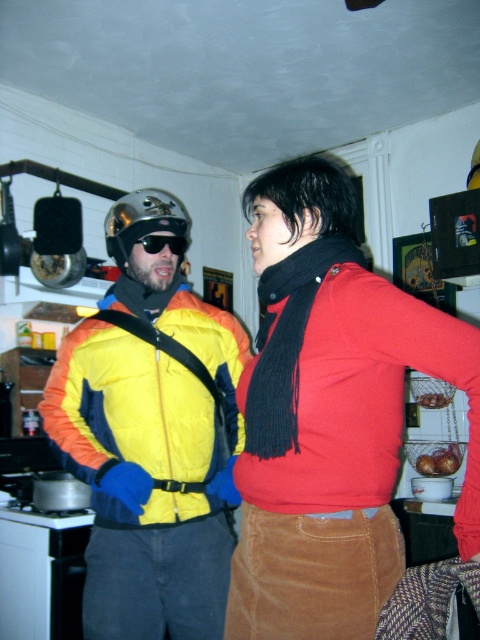
Question: Can you confirm if yellow/padded jacket at center is smaller than black fuzzy scarf at center?

Choices:
 (A) no
 (B) yes

Answer: (A)

Question: Which object is positioned farthest from the red corduroy skirt at center?

Choices:
 (A) black fuzzy scarf at center
 (B) black plastic goggles at upper left

Answer: (B)

Question: Observing the image, what is the correct spatial positioning of red corduroy skirt at center in reference to black plastic goggles at upper left?

Choices:
 (A) left
 (B) right

Answer: (B)

Question: Is black fuzzy scarf at center to the right of metallic silver helmet at upper left from the viewer's perspective?

Choices:
 (A) yes
 (B) no

Answer: (A)

Question: Which point is closer to the camera taking this photo?

Choices:
 (A) (157, 240)
 (B) (359, 544)
 (C) (271, 320)

Answer: (B)

Question: Among these points, which one is farthest from the camera?

Choices:
 (A) (368, 632)
 (B) (256, 426)
 (C) (182, 243)
 (D) (137, 547)

Answer: (C)